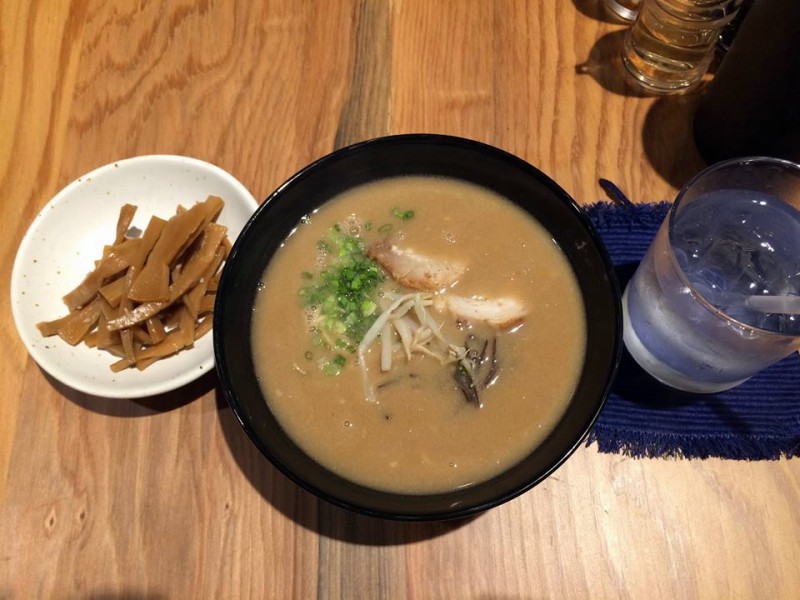
I want to click on plate, so click(480, 491).